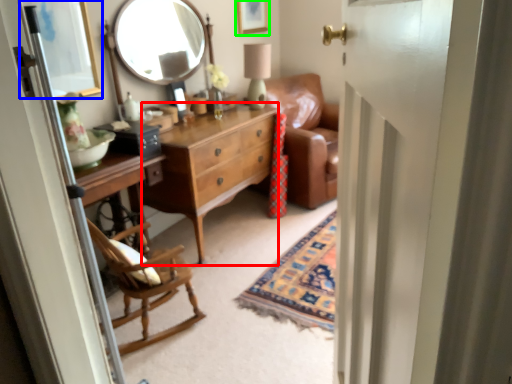
Question: Estimate the real-world distances between objects in this image. Which object is farther from cabinetry (highlighted by a red box), picture frame (highlighted by a blue box) or picture frame (highlighted by a green box)?

Choices:
 (A) picture frame
 (B) picture frame

Answer: (B)